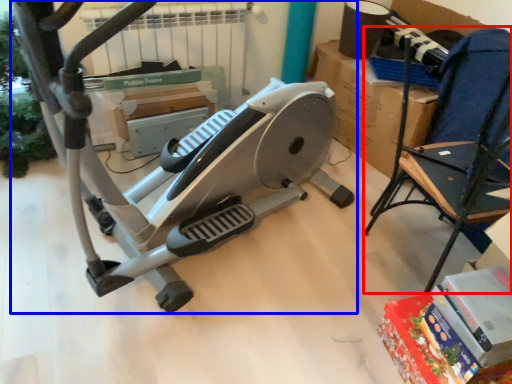
Question: Which object is closer to the camera taking this photo, chair (highlighted by a red box) or stationary bicycle (highlighted by a blue box)?

Choices:
 (A) chair
 (B) stationary bicycle

Answer: (B)